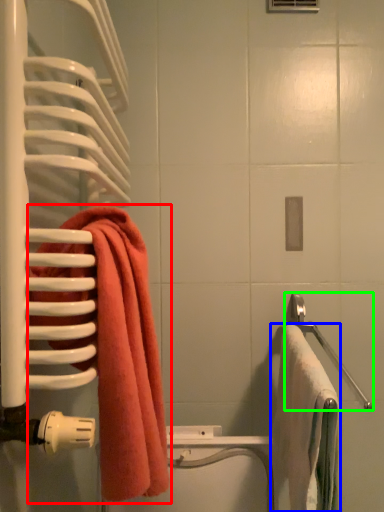
Question: Considering the real-world distances, which object is farthest from towel (highlighted by a red box)? towel (highlighted by a blue box) or towel bar (highlighted by a green box)?

Choices:
 (A) towel
 (B) towel bar

Answer: (B)